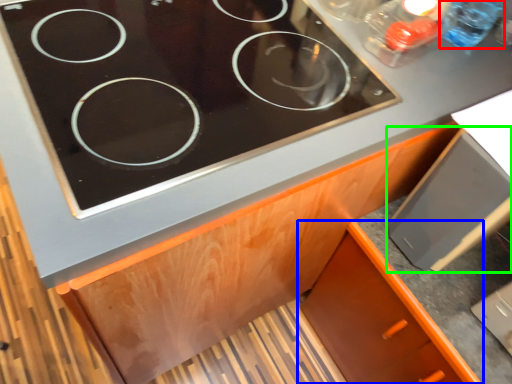
Question: Which object is positioned farthest from bottle (highlighted by a red box)? Select from cabinetry (highlighted by a blue box) and appliance (highlighted by a green box).

Choices:
 (A) cabinetry
 (B) appliance

Answer: (A)